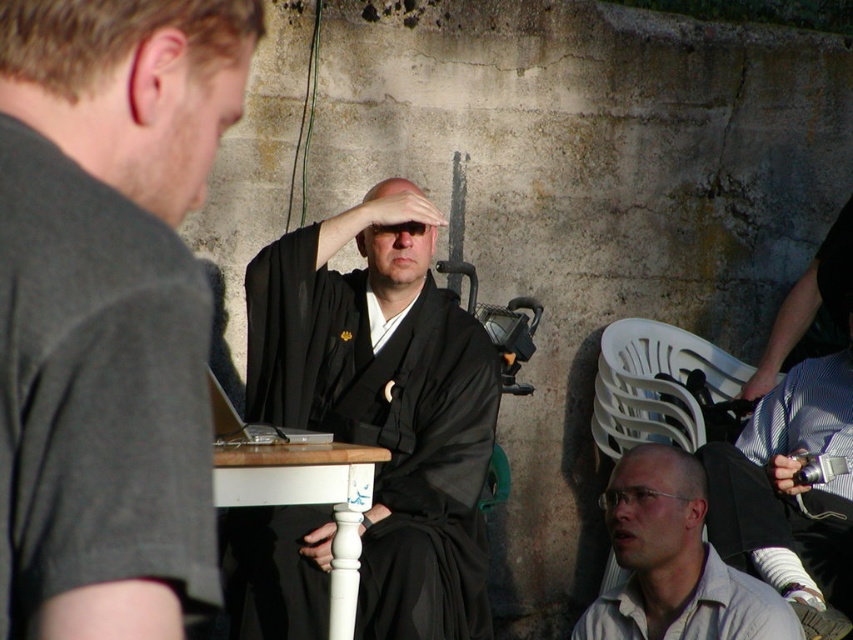
This screenshot has height=640, width=853. Identify the location of white painted wood table at center. (308, 499).

Is white painted wood table at center taller than white cotton shirt at lower right?

Yes, white painted wood table at center is taller than white cotton shirt at lower right.

You are a GUI agent. You are given a task and a screenshot of the screen. Output one action in this format:
    pyautogui.click(x=<x>, y=<y>)
    Task: Click on the white painted wood table at center
    The width and height of the screenshot is (853, 640).
    Given the screenshot: What is the action you would take?
    coord(308,499)

Can you confirm if blue striped shirt at lower right is positioned below silver metallic laptop at center?

Yes.

Does point (819, 429) come behind point (219, 435)?

Yes, it is.

Find the location of a particular element. This screenshot has height=640, width=853. blue striped shirt at lower right is located at coordinates pyautogui.click(x=804, y=417).

Who is positioned more to the right, light beige cotton shirt at lower right or white cotton shirt at lower right?

From the viewer's perspective, white cotton shirt at lower right appears more on the right side.

Can you confirm if light beige cotton shirt at lower right is positioned to the right of white cotton shirt at lower right?

In fact, light beige cotton shirt at lower right is to the left of white cotton shirt at lower right.

Where is `light beige cotton shirt at lower right`? This screenshot has width=853, height=640. light beige cotton shirt at lower right is located at coordinates (674, 561).